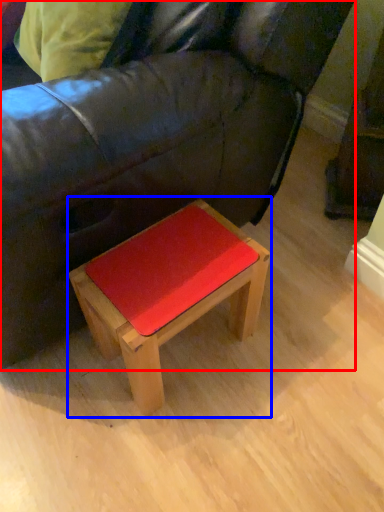
Question: Which of the following is the farthest to the observer, studio couch (highlighted by a red box) or table (highlighted by a blue box)?

Choices:
 (A) studio couch
 (B) table

Answer: (B)